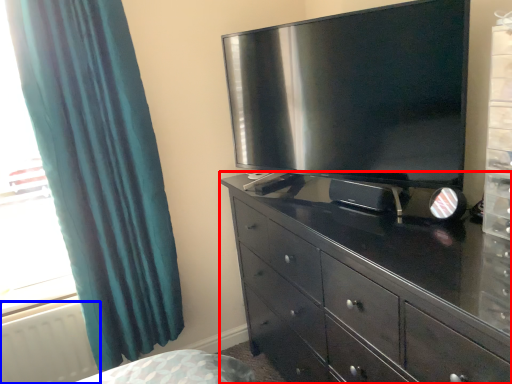
Question: Which point is closer to the camera, chest of drawers (highlighted by a red box) or radiator (highlighted by a blue box)?

Choices:
 (A) chest of drawers
 (B) radiator

Answer: (A)